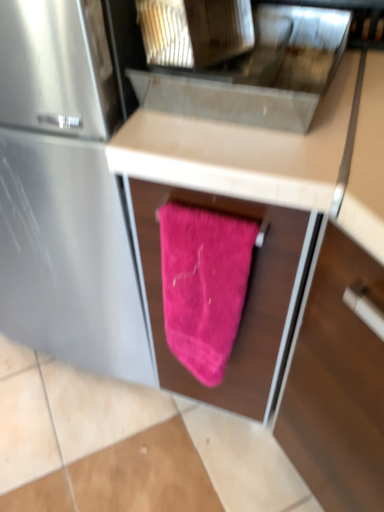
Question: Is the position of metallic stainless steel sink at upper center more distant than that of pink fabric at center?

Choices:
 (A) no
 (B) yes

Answer: (B)

Question: Is metallic stainless steel sink at upper center to the left of pink fabric at center from the viewer's perspective?

Choices:
 (A) no
 (B) yes

Answer: (B)

Question: From a real-world perspective, is metallic stainless steel sink at upper center beneath pink fabric at center?

Choices:
 (A) yes
 (B) no

Answer: (B)

Question: Is metallic stainless steel sink at upper center not inside pink fabric at center?

Choices:
 (A) yes
 (B) no

Answer: (A)

Question: Is metallic stainless steel sink at upper center looking in the opposite direction of pink fabric at center?

Choices:
 (A) yes
 (B) no

Answer: (B)

Question: Is pink fuzzy towel at center inside the boundaries of metallic stainless steel sink at upper center, or outside?

Choices:
 (A) inside
 (B) outside

Answer: (B)

Question: From a real-world perspective, is pink fuzzy towel at center above or below metallic stainless steel sink at upper center?

Choices:
 (A) above
 (B) below

Answer: (B)

Question: From the image's perspective, is pink fuzzy towel at center located above or below metallic stainless steel sink at upper center?

Choices:
 (A) above
 (B) below

Answer: (B)

Question: From their relative heights in the image, would you say pink fuzzy towel at center is taller or shorter than metallic stainless steel sink at upper center?

Choices:
 (A) tall
 (B) short

Answer: (A)

Question: In terms of width, does metallic stainless steel sink at upper center look wider or thinner when compared to pink fabric at center?

Choices:
 (A) wide
 (B) thin

Answer: (B)

Question: From the image's perspective, is metallic stainless steel sink at upper center located above or below pink fabric at center?

Choices:
 (A) above
 (B) below

Answer: (A)

Question: Considering the positions of metallic stainless steel sink at upper center and pink fabric at center in the image, is metallic stainless steel sink at upper center taller or shorter than pink fabric at center?

Choices:
 (A) tall
 (B) short

Answer: (B)

Question: Is metallic stainless steel sink at upper center situated inside pink fabric at center or outside?

Choices:
 (A) inside
 (B) outside

Answer: (B)

Question: Is pink fabric at center situated inside metallic stainless steel sink at upper center or outside?

Choices:
 (A) outside
 (B) inside

Answer: (A)

Question: Is point (261, 160) positioned closer to the camera than point (251, 89)?

Choices:
 (A) closer
 (B) farther

Answer: (A)